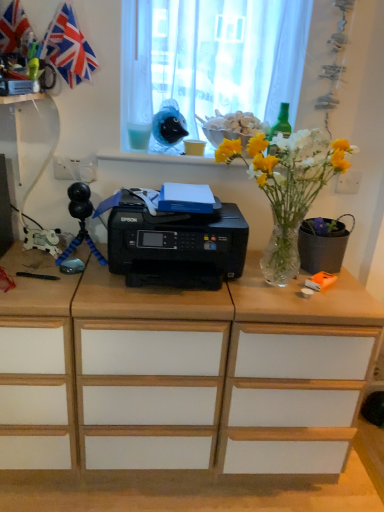
Question: From the image's perspective, is red fabric flag at upper left positioned above or below black matte flowerpot at right?

Choices:
 (A) above
 (B) below

Answer: (A)

Question: Considering the positions of point (72, 53) and point (329, 256), is point (72, 53) closer or farther from the camera than point (329, 256)?

Choices:
 (A) closer
 (B) farther

Answer: (A)

Question: Which object is the farthest from the black matte flowerpot at right?

Choices:
 (A) white sheer curtain at upper center
 (B) white paper cup at upper center, placed as the 1th stationery when sorted from left to right
 (C) green glass bottle at upper right, which ranks as the 1th stationery in right-to-left order
 (D) white plastic socket at upper left
 (E) clear glass vase at center

Answer: (D)

Question: Considering the real-world distances, which object is farthest from the clear glass vase at center?

Choices:
 (A) red fabric flag at upper left
 (B) white sheer curtain at upper center
 (C) white plastic socket at upper left
 (D) white paper cup at upper center, placed as the 1th stationery when sorted from left to right
 (E) black matte flowerpot at right

Answer: (A)